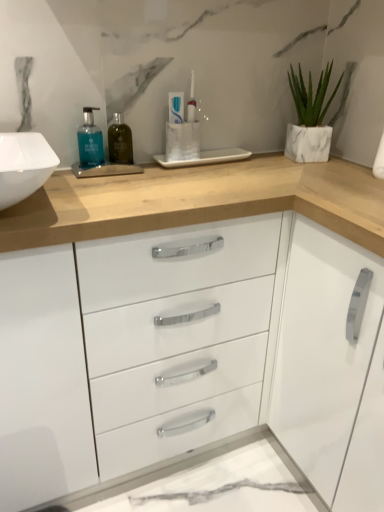
Find the location of a particular element. This screenshot has width=384, height=512. white glossy toothpaste at center is located at coordinates (176, 106).

Where is `white marble planter at upper right`? Image resolution: width=384 pixels, height=512 pixels. white marble planter at upper right is located at coordinates coord(310,118).

At what (x,y) coordinates should I click in order to perform the action: click on white glossy cabinet handle at right. Please return your answer as a coordinate pair (x, y). Looking at the image, I should click on (321, 350).

Does white glossy toothpaste at center have a greater width compared to white marble planter at upper right?

Incorrect, the width of white glossy toothpaste at center does not surpass that of white marble planter at upper right.

In the image, is white glossy toothpaste at center on the left side or the right side of white marble planter at upper right?

white glossy toothpaste at center is to the left of white marble planter at upper right.

Which object is further away from the camera taking this photo, white glossy toothpaste at center or white marble planter at upper right?

white marble planter at upper right is further from the camera.

From the picture: Which is correct: white glossy toothpaste at center is inside white marble planter at upper right, or outside of it?

white glossy toothpaste at center lies outside white marble planter at upper right.

From a real-world perspective, relative to white glossy toothpaste at center, is blue glass bottle at upper left, which is counted as the second mouthwash, starting from the right, vertically above or below?

blue glass bottle at upper left, which is counted as the second mouthwash, starting from the right, is situated lower than white glossy toothpaste at center in the real world.

Consider the image. Considering the sizes of objects blue glass bottle at upper left, which is counted as the second mouthwash, starting from the right, and white glossy toothpaste at center in the image provided, who is bigger, blue glass bottle at upper left, which is counted as the second mouthwash, starting from the right, or white glossy toothpaste at center?

Bigger between the two is blue glass bottle at upper left, which is counted as the second mouthwash, starting from the right.

Looking at this image, which is more to the left, blue glass bottle at upper left, positioned as the 1th mouthwash in left-to-right order, or white glossy toothpaste at center?

blue glass bottle at upper left, positioned as the 1th mouthwash in left-to-right order.

From the picture: Which object is further away from the camera, blue glass bottle at upper left, which is counted as the second mouthwash, starting from the right, or white glossy toothpaste at center?

white glossy toothpaste at center is behind.

From the image's perspective, is white marble planter at upper right positioned above or below white glossy toothpaste at center?

white marble planter at upper right is situated higher than white glossy toothpaste at center in the image.

Is white marble planter at upper right situated inside white glossy toothpaste at center or outside?

white marble planter at upper right lies outside white glossy toothpaste at center.

Locate an element on the screen. toothpaste above the white marble planter at upper right (from a real-world perspective) is located at coordinates (176, 106).

Between white marble planter at upper right and white glossy toothpaste at center, which one has larger width?

Wider between the two is white marble planter at upper right.

Consider the image. Considering the relative sizes of blue glass bottle at upper left, which is counted as the second mouthwash, starting from the right, and green glass bottle at center, which ranks as the first mouthwash in right-to-left order, in the image provided, is blue glass bottle at upper left, which is counted as the second mouthwash, starting from the right, thinner than green glass bottle at center, which ranks as the first mouthwash in right-to-left order,?

No.

Considering the sizes of objects blue glass bottle at upper left, positioned as the 1th mouthwash in left-to-right order, and green glass bottle at center, which ranks as the first mouthwash in right-to-left order, in the image provided, who is bigger, blue glass bottle at upper left, positioned as the 1th mouthwash in left-to-right order, or green glass bottle at center, which ranks as the first mouthwash in right-to-left order,?

green glass bottle at center, which ranks as the first mouthwash in right-to-left order.

Choose the correct answer: Is blue glass bottle at upper left, which is counted as the second mouthwash, starting from the right, inside green glass bottle at center, which appears as the 2th mouthwash when viewed from the left, or outside it?

blue glass bottle at upper left, which is counted as the second mouthwash, starting from the right, lies outside green glass bottle at center, which appears as the 2th mouthwash when viewed from the left.

Is blue glass bottle at upper left, which is counted as the second mouthwash, starting from the right, oriented away from green glass bottle at center, which appears as the 2th mouthwash when viewed from the left?

blue glass bottle at upper left, which is counted as the second mouthwash, starting from the right, is not turned away from green glass bottle at center, which appears as the 2th mouthwash when viewed from the left.

Can you tell me how much white glossy toothpaste at center and blue glass bottle at upper left, which is counted as the second mouthwash, starting from the right, differ in facing direction?

The facing directions of white glossy toothpaste at center and blue glass bottle at upper left, which is counted as the second mouthwash, starting from the right, are 4.51 degrees apart.

Is white glossy toothpaste at center taller or shorter than blue glass bottle at upper left, positioned as the 1th mouthwash in left-to-right order?

white glossy toothpaste at center is shorter than blue glass bottle at upper left, positioned as the 1th mouthwash in left-to-right order.

Identify the location of the 1st mouthwash directly beneath the white glossy toothpaste at center (from a real-world perspective). Image resolution: width=384 pixels, height=512 pixels. (90, 141).

Who is bigger, white glossy toothpaste at center or blue glass bottle at upper left, which is counted as the second mouthwash, starting from the right?

Bigger between the two is blue glass bottle at upper left, which is counted as the second mouthwash, starting from the right.

How many degrees apart are the facing directions of white glossy toothpaste at center and green glass bottle at center, which ranks as the first mouthwash in right-to-left order?

1.28 degrees separate the facing orientations of white glossy toothpaste at center and green glass bottle at center, which ranks as the first mouthwash in right-to-left order.

In the scene shown: From the image's perspective, does white glossy toothpaste at center appear lower than green glass bottle at center, which ranks as the first mouthwash in right-to-left order?

No, from the image's perspective, white glossy toothpaste at center is not below green glass bottle at center, which ranks as the first mouthwash in right-to-left order.

Is green glass bottle at center, which ranks as the first mouthwash in right-to-left order, a part of white glossy toothpaste at center?

No.

Image resolution: width=384 pixels, height=512 pixels. Find the location of `houseplant that appears above the green glass bottle at center, which ranks as the first mouthwash in right-to-left order (from a real-world perspective)`. houseplant that appears above the green glass bottle at center, which ranks as the first mouthwash in right-to-left order (from a real-world perspective) is located at coordinates (x=310, y=118).

Between white marble planter at upper right and green glass bottle at center, which appears as the 2th mouthwash when viewed from the left, which one has larger size?

Bigger between the two is white marble planter at upper right.

Does white marble planter at upper right have a lesser height compared to green glass bottle at center, which ranks as the first mouthwash in right-to-left order?

In fact, white marble planter at upper right may be taller than green glass bottle at center, which ranks as the first mouthwash in right-to-left order.

This screenshot has height=512, width=384. Find the location of `toothpaste above the white marble planter at upper right (from a real-world perspective)`. toothpaste above the white marble planter at upper right (from a real-world perspective) is located at coordinates 176,106.

Which mouthwash is the 2nd one when counting from the front of the white glossy toothpaste at center? Please provide its 2D coordinates.

[(90, 141)]

Which object lies nearer to the anchor point blue glass bottle at upper left, positioned as the 1th mouthwash in left-to-right order, white glossy toothpaste at center or white marble planter at upper right?

Based on the image, white glossy toothpaste at center appears to be nearer to blue glass bottle at upper left, positioned as the 1th mouthwash in left-to-right order.

Considering their positions, is green glass bottle at center, which appears as the 2th mouthwash when viewed from the left, positioned closer to white marble planter at upper right than blue glass bottle at upper left, positioned as the 1th mouthwash in left-to-right order?

Among the two, green glass bottle at center, which appears as the 2th mouthwash when viewed from the left, is located nearer to white marble planter at upper right.

Which object lies nearer to the anchor point white glossy cabinet handle at right, green glass bottle at center, which appears as the 2th mouthwash when viewed from the left, or white marble planter at upper right?

white marble planter at upper right.

Considering their positions, is white marble planter at upper right positioned further to green glass bottle at center, which appears as the 2th mouthwash when viewed from the left, than white glossy cabinet handle at right?

white glossy cabinet handle at right is positioned further to the anchor green glass bottle at center, which appears as the 2th mouthwash when viewed from the left.

Based on their spatial positions, is blue glass bottle at upper left, positioned as the 1th mouthwash in left-to-right order, or white glossy toothpaste at center closer to green glass bottle at center, which appears as the 2th mouthwash when viewed from the left?

blue glass bottle at upper left, positioned as the 1th mouthwash in left-to-right order, lies closer to green glass bottle at center, which appears as the 2th mouthwash when viewed from the left, than the other object.

When comparing their distances from green glass bottle at center, which ranks as the first mouthwash in right-to-left order, does white marble planter at upper right or blue glass bottle at upper left, which is counted as the second mouthwash, starting from the right, seem closer?

blue glass bottle at upper left, which is counted as the second mouthwash, starting from the right, is closer to green glass bottle at center, which ranks as the first mouthwash in right-to-left order.

Considering their positions, is green glass bottle at center, which ranks as the first mouthwash in right-to-left order, positioned further to white glossy toothpaste at center than white marble planter at upper right?

white marble planter at upper right is positioned further to the anchor white glossy toothpaste at center.

Which object lies further to the anchor point white glossy toothpaste at center, white glossy cabinet handle at right or white marble planter at upper right?

The object further to white glossy toothpaste at center is white glossy cabinet handle at right.

Where is `toothpaste situated between blue glass bottle at upper left, positioned as the 1th mouthwash in left-to-right order, and white marble planter at upper right from left to right`? The width and height of the screenshot is (384, 512). toothpaste situated between blue glass bottle at upper left, positioned as the 1th mouthwash in left-to-right order, and white marble planter at upper right from left to right is located at coordinates (176, 106).

What are the coordinates of `toothpaste between white marble planter at upper right and white glossy cabinet handle at right vertically` in the screenshot? It's located at (176, 106).

Locate an element on the screen. mouthwash between blue glass bottle at upper left, which is counted as the second mouthwash, starting from the right, and white glossy cabinet handle at right, in the horizontal direction is located at coordinates (120, 141).

Find the location of a particular element. Image resolution: width=384 pixels, height=512 pixels. toothpaste between blue glass bottle at upper left, which is counted as the second mouthwash, starting from the right, and white glossy cabinet handle at right from left to right is located at coordinates pyautogui.click(x=176, y=106).